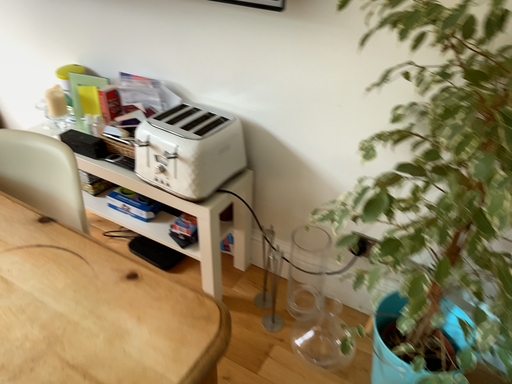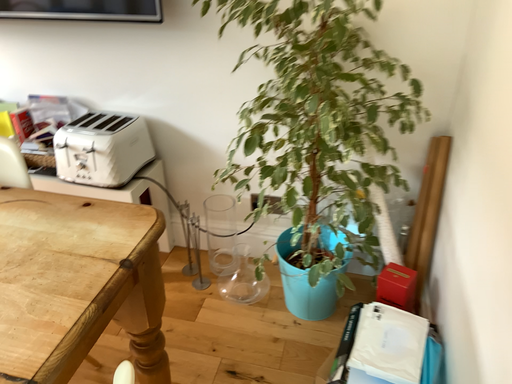
Question: Which way did the camera rotate in the video?

Choices:
 (A) rotated left
 (B) rotated right

Answer: (B)